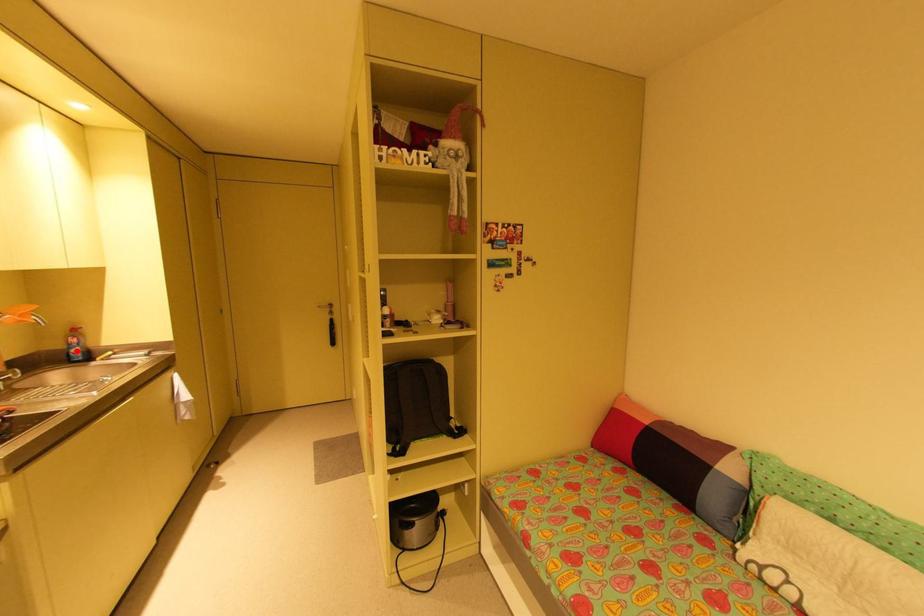
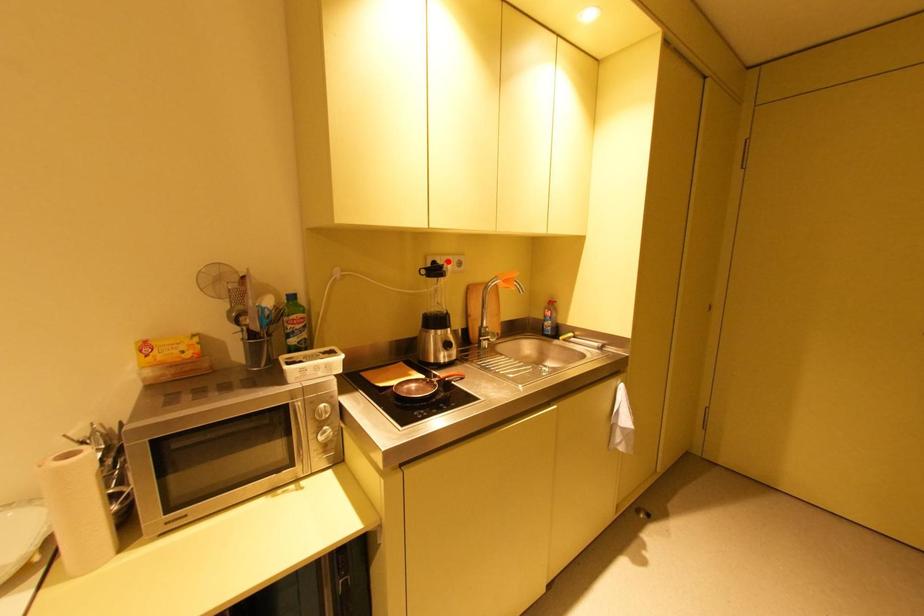
I am providing you with two images of the same scene from different viewpoints. A red point is marked on the first image and another point is marked on the second image. Is the red point in image1 aligned with the point shown in image2?

No